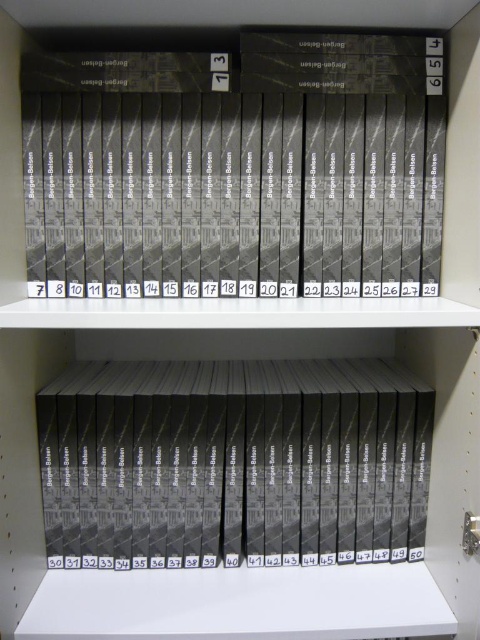
Question: Can you confirm if matte black book at upper center is wider than matte black book at center?

Choices:
 (A) no
 (B) yes

Answer: (B)

Question: Is matte black book at upper center bigger than matte black book at center?

Choices:
 (A) no
 (B) yes

Answer: (A)

Question: Among these objects, which one is farthest from the camera?

Choices:
 (A) matte black book at center
 (B) matte black book at upper center

Answer: (A)

Question: Which object is farther from the camera taking this photo?

Choices:
 (A) matte black book at center
 (B) matte black book at upper center

Answer: (A)

Question: Does matte black book at upper center have a lesser width compared to matte black book at center?

Choices:
 (A) yes
 (B) no

Answer: (B)